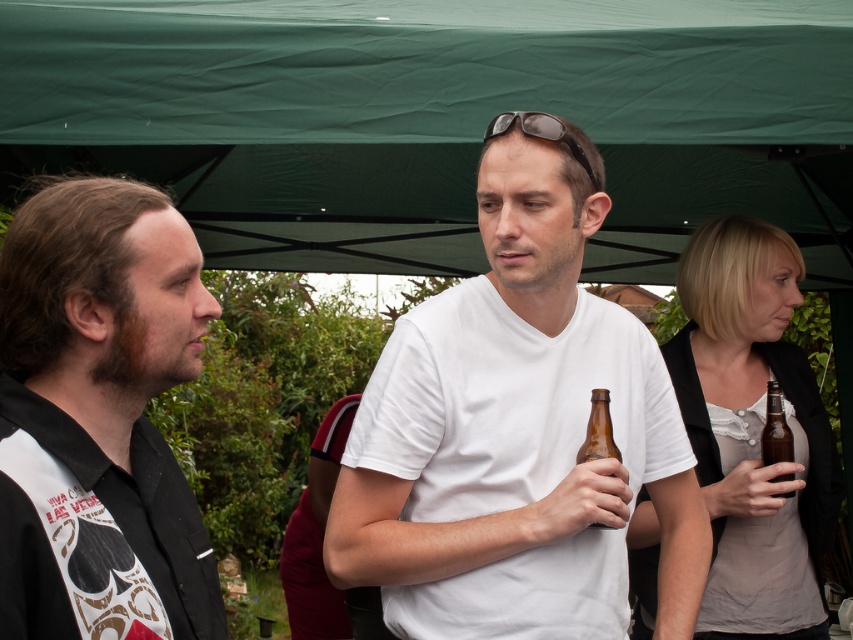
Between black matte shirt at left and matte gray shirt at right, which one appears on the right side from the viewer's perspective?

matte gray shirt at right

Which is below, black matte shirt at left or matte gray shirt at right?

matte gray shirt at right

Where is `black matte shirt at left`? This screenshot has height=640, width=853. black matte shirt at left is located at coordinates (93, 412).

Find the location of a particular element. black matte shirt at left is located at coordinates click(93, 412).

Can you confirm if black matte shirt at left is thinner than brown glass bottle at right?

In fact, black matte shirt at left might be wider than brown glass bottle at right.

Where is `black matte shirt at left`? The image size is (853, 640). black matte shirt at left is located at coordinates (93, 412).

Between point (42, 291) and point (782, 452), which one is positioned behind?

Point (782, 452)

Identify the location of black matte shirt at left. (93, 412).

Is point (482, 340) closer to camera compared to point (780, 420)?

Yes, it is.

Can you confirm if white matte t-shirt at center is taller than brown glass bottle at right?

Correct, white matte t-shirt at center is much taller as brown glass bottle at right.

Which is in front, point (492, 140) or point (782, 432)?

Point (492, 140) is in front.

Where is `white matte t-shirt at center`? This screenshot has width=853, height=640. white matte t-shirt at center is located at coordinates (515, 436).